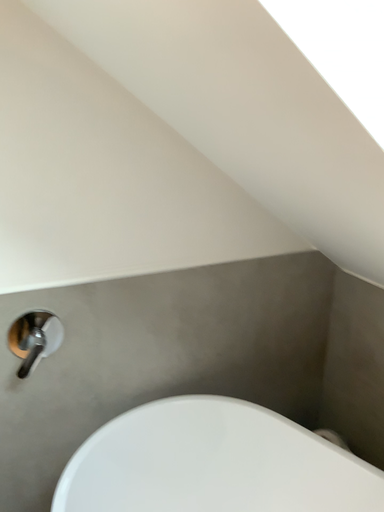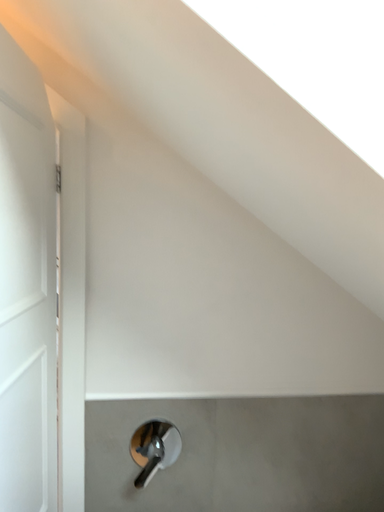
Question: Which way did the camera rotate in the video?

Choices:
 (A) rotated upward
 (B) rotated downward

Answer: (A)